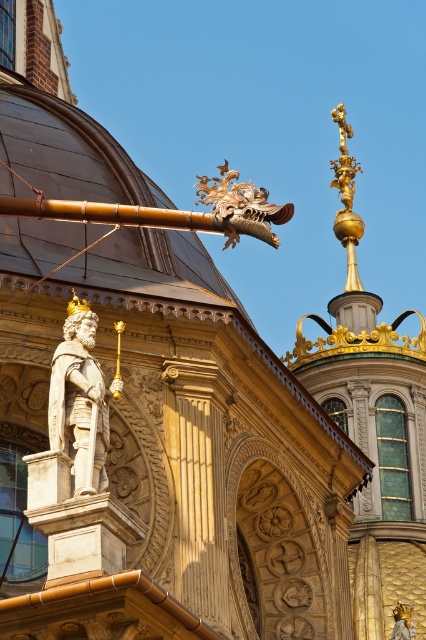
Question: Which point is closer to the camera?

Choices:
 (A) gold textured dragon at upper center
 (B) polished bronze statue at center

Answer: (A)

Question: Is polished bronze statue at center above gold textured dragon at upper center?

Choices:
 (A) no
 (B) yes

Answer: (A)

Question: Does polished bronze statue at center have a lesser width compared to gold textured dragon at upper center?

Choices:
 (A) no
 (B) yes

Answer: (B)

Question: Which point is closer to the camera?

Choices:
 (A) (201, 179)
 (B) (91, 310)

Answer: (B)

Question: Can you confirm if polished bronze statue at center is positioned to the left of gold textured dragon at upper center?

Choices:
 (A) no
 (B) yes

Answer: (B)